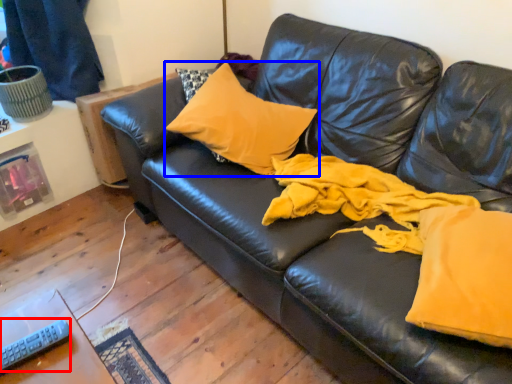
Question: Among these objects, which one is farthest to the camera, remote (highlighted by a red box) or pillow (highlighted by a blue box)?

Choices:
 (A) remote
 (B) pillow

Answer: (B)